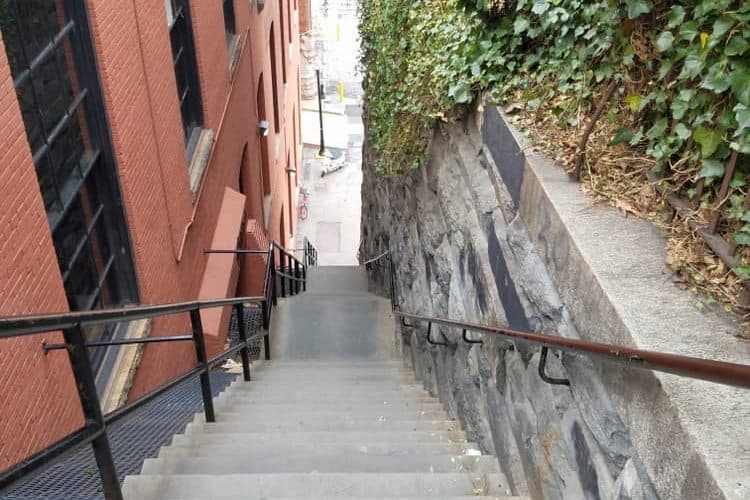
Image resolution: width=750 pixels, height=500 pixels. In order to click on windows in this screenshot , I will do `click(105, 201)`, `click(184, 81)`, `click(226, 25)`, `click(246, 164)`, `click(261, 101)`, `click(276, 70)`, `click(282, 48)`, `click(288, 24)`, `click(261, 4)`.